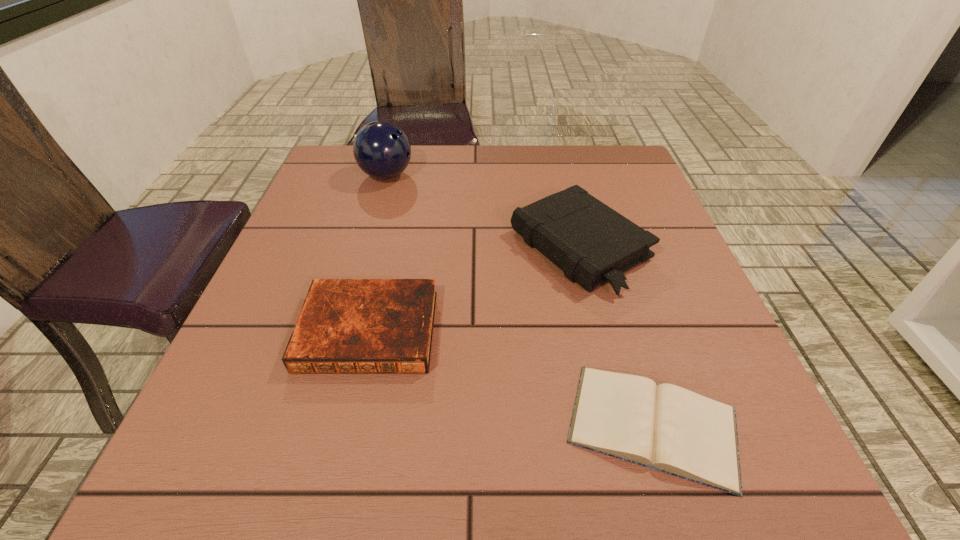
You are a GUI agent. You are given a task and a screenshot of the screen. Output one action in this format:
    pyautogui.click(x=<x>, y=<y>)
    Task: Click on the object that is at the far edge
    This screenshot has height=540, width=960.
    Given the screenshot: What is the action you would take?
    pyautogui.click(x=382, y=150)

This screenshot has height=540, width=960. I want to click on object that is positioned at the near edge, so click(x=665, y=427).

Where is `bowling ball that is positioned at the left edge`? This screenshot has width=960, height=540. bowling ball that is positioned at the left edge is located at coordinates (382, 150).

I want to click on Bible located at the left edge, so click(346, 326).

Where is `object located in the far left corner section of the desktop`? Image resolution: width=960 pixels, height=540 pixels. object located in the far left corner section of the desktop is located at coordinates (382, 150).

Where is `object at the near right corner`? object at the near right corner is located at coordinates (665, 427).

Identify the location of free space at the far edge of the desktop. [478, 174].

The height and width of the screenshot is (540, 960). What are the coordinates of `vacant space at the near edge` in the screenshot? It's located at (303, 464).

Where is `free space at the left edge`? The image size is (960, 540). free space at the left edge is located at coordinates (287, 292).

Image resolution: width=960 pixels, height=540 pixels. In the image, there is a desktop. Find the location of `free space at the right edge`. free space at the right edge is located at coordinates (744, 379).